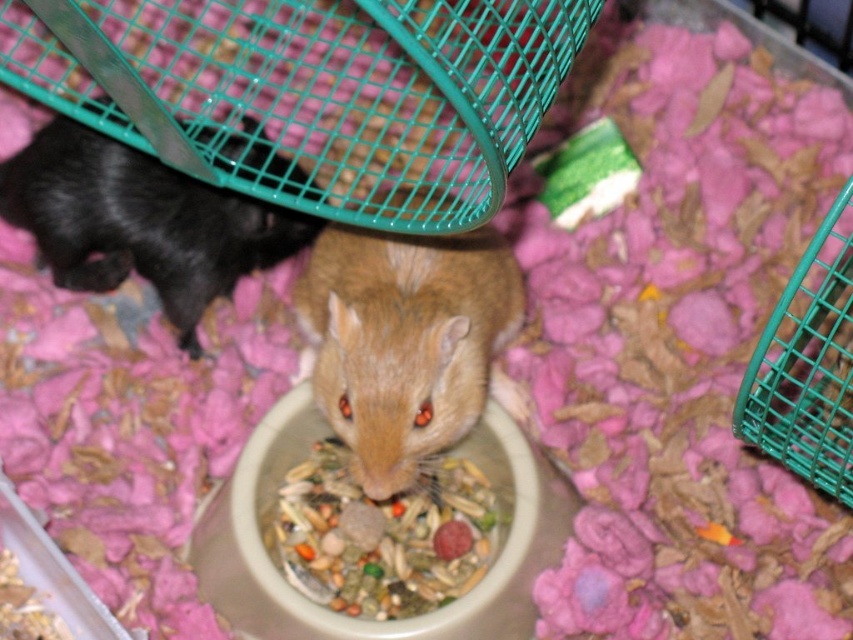
You are a veterinarian examining a hamster in an enclosure. You need to reach the fuzzy brown hamster at center to check its health. The enclosure has a transparent front panel that is 1 meter away from the camera. Can you reach the hamster through the panel without opening the enclosure?

The fuzzy brown hamster at center is 1.23 meters away from the camera. Since the enclosure panel is only 1 meter away, the hamster is 0.23 meters behind the panel. Therefore, you cannot reach it without opening the enclosure.